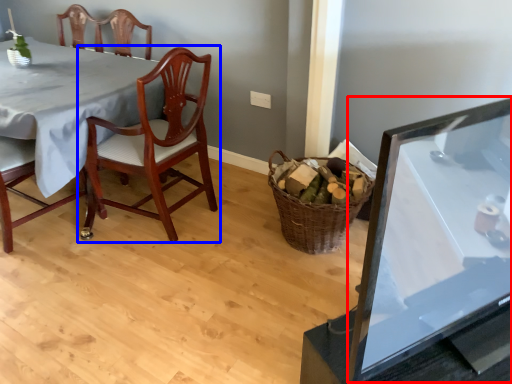
Question: Among these objects, which one is nearest to the camera, table (highlighted by a red box) or chair (highlighted by a blue box)?

Choices:
 (A) table
 (B) chair

Answer: (A)